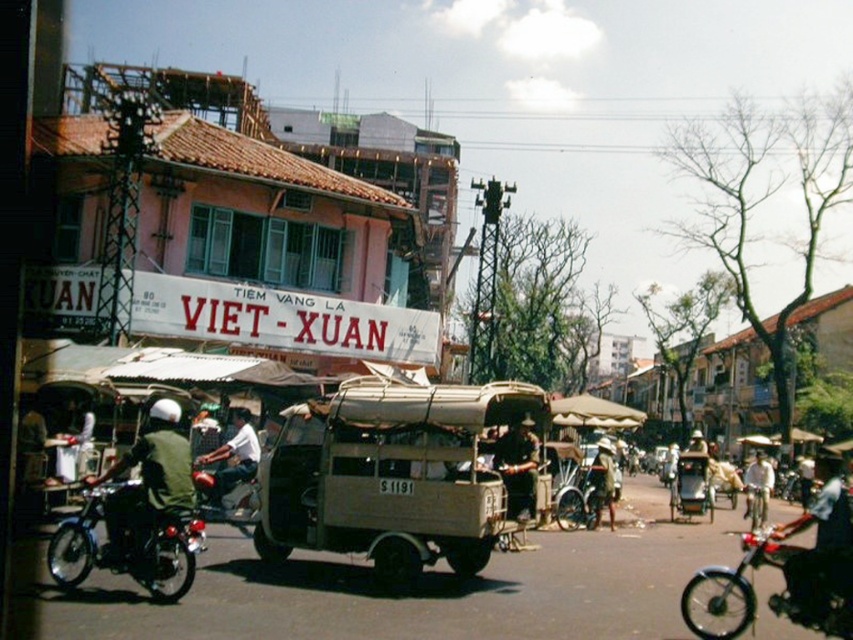
Question: Considering the relative positions of beige canvas rickshaw at center and light brown leather jacket at center-left in the image provided, where is beige canvas rickshaw at center located with respect to light brown leather jacket at center-left?

Choices:
 (A) right
 (B) left

Answer: (A)

Question: Which object is closer to the camera taking this photo?

Choices:
 (A) green fabric helmet at left
 (B) shiny black motorcycle at lower left
 (C) light brown leather helmet at center
 (D) light brown leather jacket at center-left

Answer: (B)

Question: Is beige canvas rickshaw at center thinner than dark blue jeans at lower right?

Choices:
 (A) yes
 (B) no

Answer: (A)

Question: Among these points, which one is nearest to the camera?

Choices:
 (A) (93, 563)
 (B) (248, 460)

Answer: (A)

Question: Is shiny black motorcycle at lower left thinner than dark brown leather jacket at center?

Choices:
 (A) no
 (B) yes

Answer: (A)

Question: Which object is positioned closest to the dark blue jeans at lower right?

Choices:
 (A) light brown leather jacket at center-left
 (B) light brown wooden bicycle at center

Answer: (B)